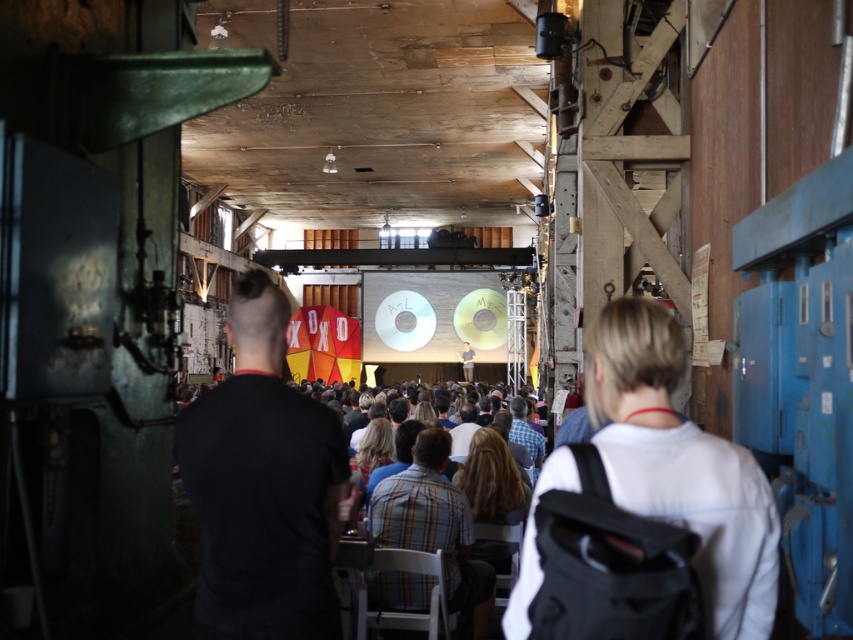
You are an event organizer and need to ensure there is enough space between the black shirt at center and the white fabric shirt at center for attendees to move comfortably. Based on the image, which direction should you direct people to walk around them?

The black shirt at center is closer to you than the white fabric shirt at center, so people should walk around the black shirt at center first before approaching the white fabric shirt at center to maintain proper spacing.

You are planning to take a photo of the black shirt at center and the white fabric shirt at center from the front of the stage. Which of the two shirts will appear larger in the photo?

The white fabric shirt at center will appear larger in the photo because it is larger than the black shirt at center.

You are a photographer standing at the back of the venue. You want to capture a photo of both the black shirt at center and the white fabric shirt at center in the same frame. Given that your camera has a minimum focus distance of 1 meter, will you be able to focus on both subjects simultaneously?

The black shirt at center and white fabric shirt at center are 1.12 meters apart. Since the distance between them is greater than the camera minimum focus distance of 1 meter, the camera can focus on both subjects simultaneously.